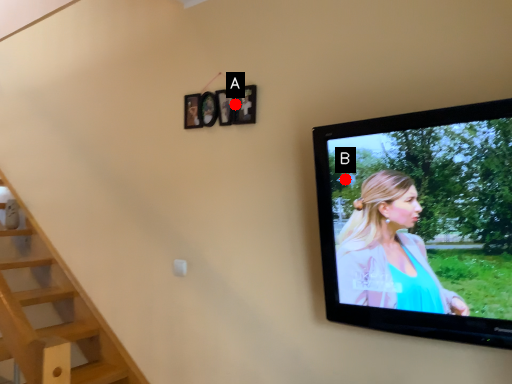
Question: Two points are circled on the image, labeled by A and B beside each circle. Which point is closer to the camera taking this photo?

Choices:
 (A) A is closer
 (B) B is closer

Answer: (B)